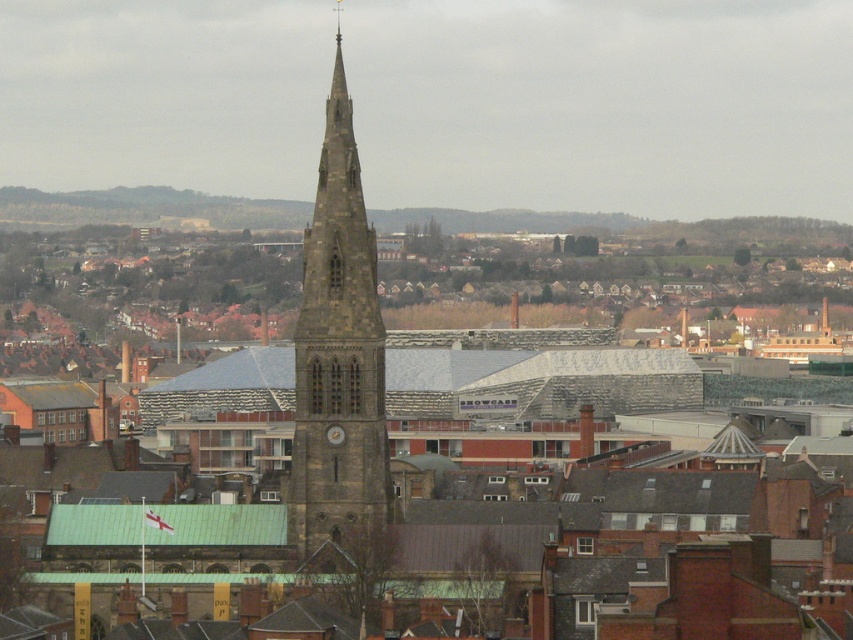
Does dark gray stone church steeple at center have a larger size compared to dark gray stone tower at center?

Yes, dark gray stone church steeple at center is bigger than dark gray stone tower at center.

Between dark gray stone church steeple at center and dark gray stone tower at center, which one is positioned lower?

dark gray stone church steeple at center is lower down.

Who is more forward, (131, 387) or (316, 284)?

Positioned in front is point (316, 284).

Identify the location of dark gray stone church steeple at center. (538, 376).